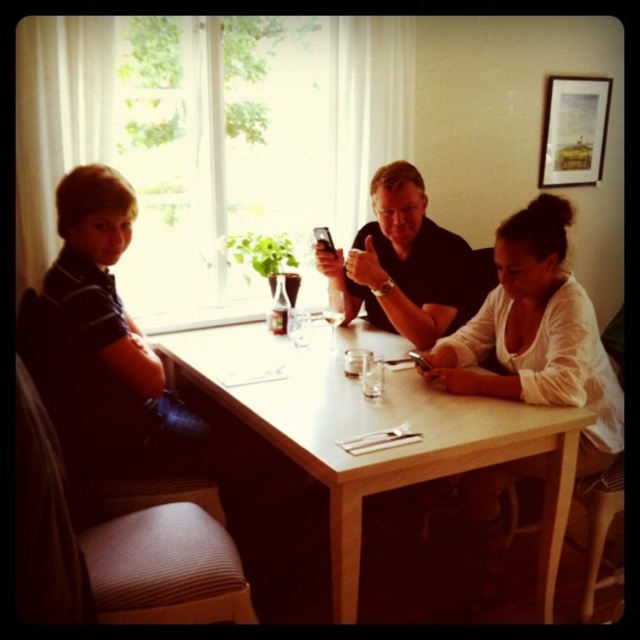
You are a server at a restaurant and need to place a 1.2 meter wide tray on the table. Can the light wood table at center accommodate the tray without it hanging off the edge? Please consider the matte black shirt at center in your assessment.

The light wood table at center might be wider than matte black shirt at center, but without specific measurements, it is uncertain whether the tray will fit. Check the table dimensions before placing the tray.

You are standing in the room and want to reach the point at coordinates (177,362). If your arm can reach 6 feet, can you reach that point without moving?

The point at coordinates (177,362) is 7.20 feet away from the viewer, which is beyond the 6 feet reach of your arm. Therefore, you cannot reach it without moving.